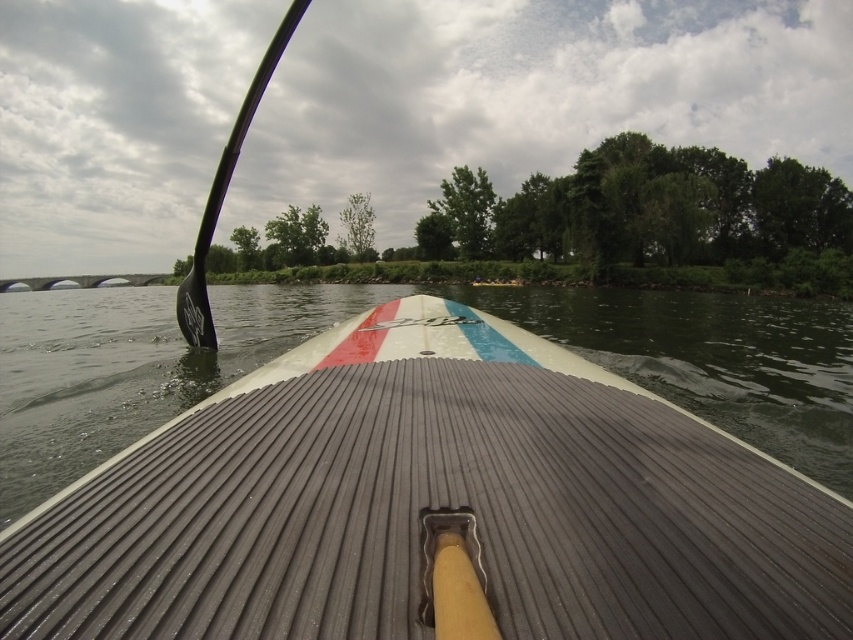
Question: Is smooth gray paddleboard at center wider than black rubber paddle at left?

Choices:
 (A) no
 (B) yes

Answer: (A)

Question: Does smooth gray paddleboard at center appear over black rubber paddle at left?

Choices:
 (A) yes
 (B) no

Answer: (B)

Question: Does smooth gray paddleboard at center have a larger size compared to black rubber paddle at left?

Choices:
 (A) yes
 (B) no

Answer: (B)

Question: Among these points, which one is nearest to the camera?

Choices:
 (A) (292, 8)
 (B) (86, 520)

Answer: (B)